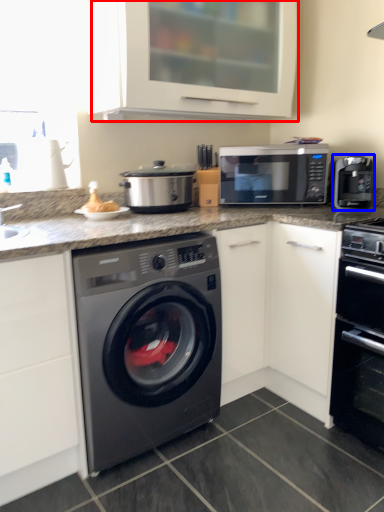
Question: Which object appears closest to the camera in this image, cabinetry (highlighted by a red box) or coffee machine (highlighted by a blue box)?

Choices:
 (A) cabinetry
 (B) coffee machine

Answer: (A)